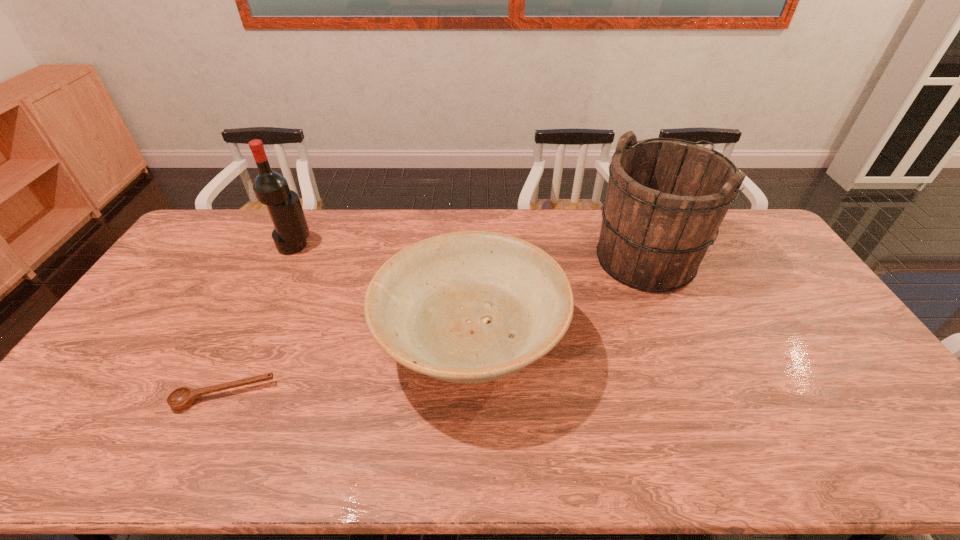
I want to click on wine bottle located at the far edge, so click(x=271, y=188).

Where is `vacant space at the far edge of the desktop`? vacant space at the far edge of the desktop is located at coordinates (364, 211).

Find the location of `vacant space at the near edge of the desktop`. vacant space at the near edge of the desktop is located at coordinates (387, 447).

Find the location of a particular element. The image size is (960, 540). vacant space at the left edge of the desktop is located at coordinates (166, 331).

Locate an element on the screen. The height and width of the screenshot is (540, 960). vacant space at the right edge of the desktop is located at coordinates (776, 264).

Where is `free space between the shortest object and the second shortest object`? free space between the shortest object and the second shortest object is located at coordinates (347, 370).

Find the location of a particular element. This screenshot has width=960, height=540. free space that is in between the wooden spoon and the wine bottle is located at coordinates (259, 321).

Locate an element on the screen. free space between the shortest object and the wine bottle is located at coordinates (259, 321).

At what (x,y) coordinates should I click in order to perform the action: click on object that ranks as the second closest to the wooden spoon. Please return your answer as a coordinate pair (x, y). The width and height of the screenshot is (960, 540). Looking at the image, I should click on (x=271, y=188).

Where is `object that stands as the closest to the bucket`? object that stands as the closest to the bucket is located at coordinates (470, 307).